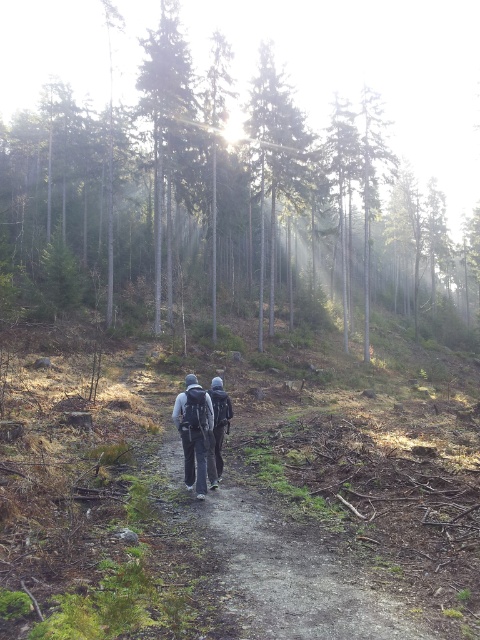
Question: Does dirt path at center have a greater width compared to dark gray backpack at center?

Choices:
 (A) no
 (B) yes

Answer: (A)

Question: Among these objects, which one is nearest to the camera?

Choices:
 (A) smooth silver pole at center
 (B) dark gray fabric jacket at center

Answer: (B)

Question: Which point is farther from the camera taking this photo?

Choices:
 (A) pyautogui.click(x=276, y=170)
 (B) pyautogui.click(x=333, y=552)
 (C) pyautogui.click(x=197, y=440)
 (D) pyautogui.click(x=194, y=16)

Answer: (D)

Question: Is smooth silver pole at center below dark gray fabric jacket at center?

Choices:
 (A) no
 (B) yes

Answer: (A)

Question: Can you confirm if dirt path at center is positioned to the left of dark gray backpack at center?

Choices:
 (A) yes
 (B) no

Answer: (B)

Question: Estimate the real-world distances between objects in this image. Which object is closer to the dark gray backpack at center?

Choices:
 (A) green matte trees at upper center
 (B) dirt path at center
 (C) smooth silver pole at center

Answer: (B)